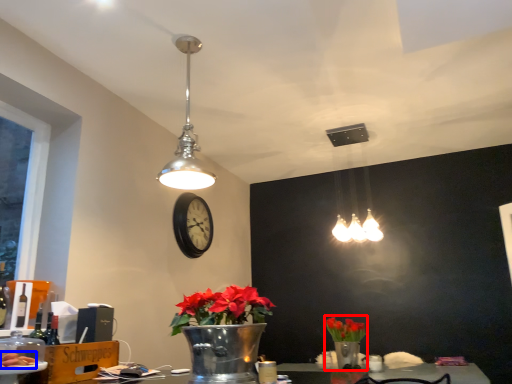
Question: Which of the following is the closest to the observer, floral arrangement (highlighted by a red box) or food (highlighted by a blue box)?

Choices:
 (A) floral arrangement
 (B) food

Answer: (B)